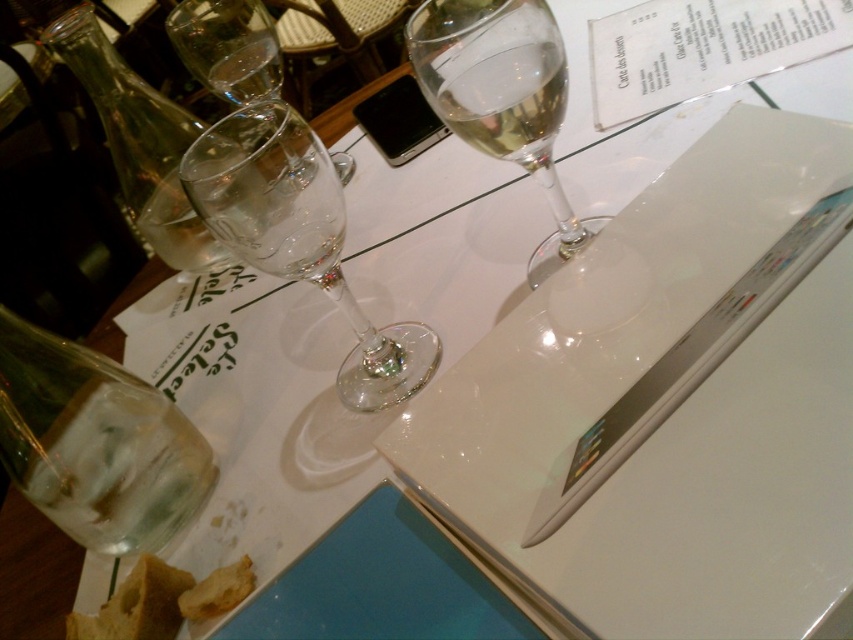
Question: Does clear glass wine glass at upper left have a greater width compared to clear glass at upper center?

Choices:
 (A) no
 (B) yes

Answer: (B)

Question: Does transparent glass wine glass at center have a lesser width compared to clear glass wine glass at center?

Choices:
 (A) no
 (B) yes

Answer: (A)

Question: Which of the following is the farthest from the observer?

Choices:
 (A) (292, 230)
 (B) (241, 93)
 (C) (154, 129)
 (D) (99, 380)

Answer: (C)

Question: Can you confirm if transparent glass wine glass at center is thinner than transparent glass bottle at left?

Choices:
 (A) no
 (B) yes

Answer: (B)

Question: Which point is closer to the camera?

Choices:
 (A) (202, 1)
 (B) (294, 134)
 (C) (444, 120)
 (D) (430, 70)

Answer: (B)

Question: Which point is farther to the camera?

Choices:
 (A) (561, 244)
 (B) (195, 436)
 (C) (231, 92)
 (D) (115, 138)

Answer: (D)